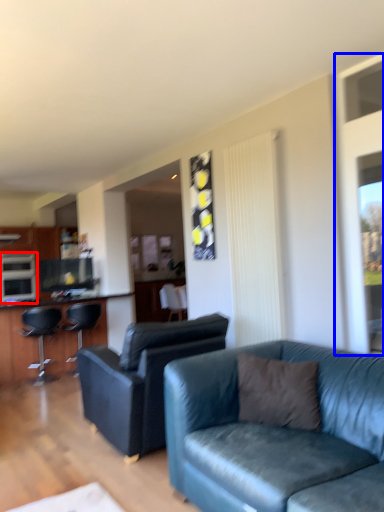
Question: Among these objects, which one is farthest to the camera, appliance (highlighted by a red box) or window screen (highlighted by a blue box)?

Choices:
 (A) appliance
 (B) window screen

Answer: (A)